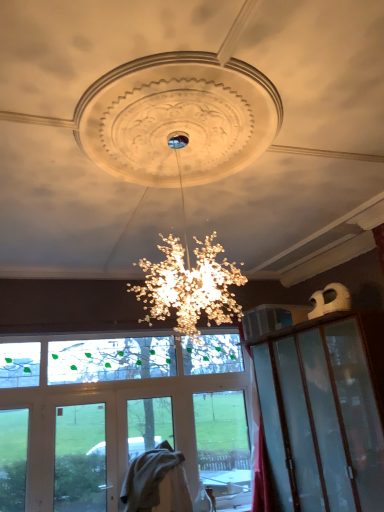
Question: Can you confirm if clear glass door at center is positioned to the right of transparent glass window screen at center?

Choices:
 (A) no
 (B) yes

Answer: (A)

Question: Is clear glass door at center positioned in front of transparent glass window screen at center?

Choices:
 (A) no
 (B) yes

Answer: (B)

Question: From the image's perspective, does clear glass door at center appear higher than transparent glass window screen at center?

Choices:
 (A) yes
 (B) no

Answer: (B)

Question: Is clear glass door at center behind transparent glass window screen at center?

Choices:
 (A) yes
 (B) no

Answer: (B)

Question: Does clear glass door at center have a greater height compared to transparent glass window screen at center?

Choices:
 (A) no
 (B) yes

Answer: (B)

Question: Does clear glass door at center turn towards transparent glass window screen at center?

Choices:
 (A) no
 (B) yes

Answer: (A)

Question: From the image's perspective, does transparent glass window screen at center appear lower than clear glass door at center?

Choices:
 (A) yes
 (B) no

Answer: (B)

Question: Would you say transparent glass window screen at center contains clear glass door at center?

Choices:
 (A) yes
 (B) no

Answer: (B)

Question: Does transparent glass window screen at center have a greater width compared to clear glass door at center?

Choices:
 (A) no
 (B) yes

Answer: (A)

Question: Is transparent glass window screen at center at the right side of clear glass door at center?

Choices:
 (A) yes
 (B) no

Answer: (A)

Question: Does transparent glass window screen at center have a greater height compared to clear glass door at center?

Choices:
 (A) no
 (B) yes

Answer: (A)

Question: Considering the relative sizes of transparent glass window screen at center and clear glass door at center in the image provided, is transparent glass window screen at center thinner than clear glass door at center?

Choices:
 (A) no
 (B) yes

Answer: (B)

Question: Is point (105, 351) closer or farther from the camera than point (72, 472)?

Choices:
 (A) closer
 (B) farther

Answer: (B)